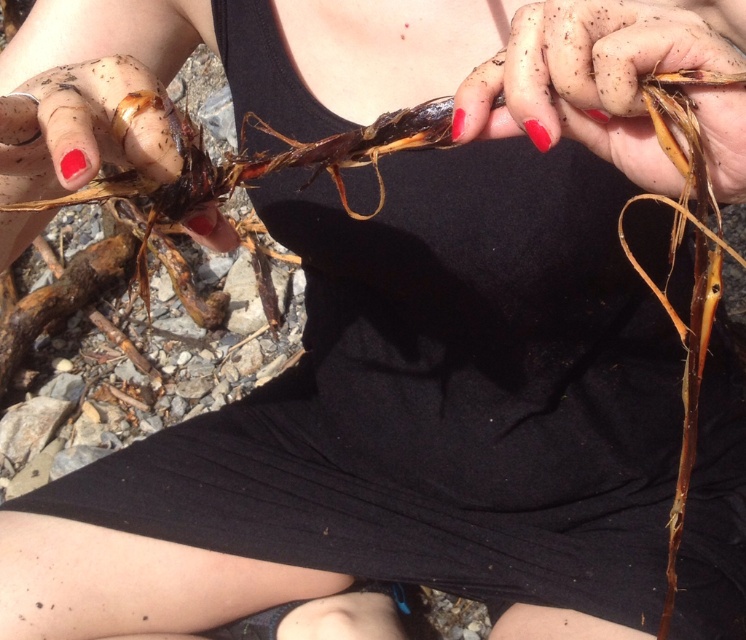
You are a botanist examining two plant parts in the image. The dull brown skin at center and the matte brown root at left. Which one is longer?

The matte brown root at left is longer than the dull brown skin at center.

You are a botanist examining the plant materials in the image. Which object is closer to you, the dull brown skin at center or the matte brown root at left?

The dull brown skin at center is closer to you because it is in front of the matte brown root at left.

You are a photographer trying to capture the detailed texture of the dried plant stems. You notice two points marked in the image. Which point, point 1 at coordinates (630, 177) or point 2 at (22, 244), is closer to the camera lens?

Point 1 at coordinates (630, 177) is closer to the camera lens because it is in front of point 2 at (22, 244).